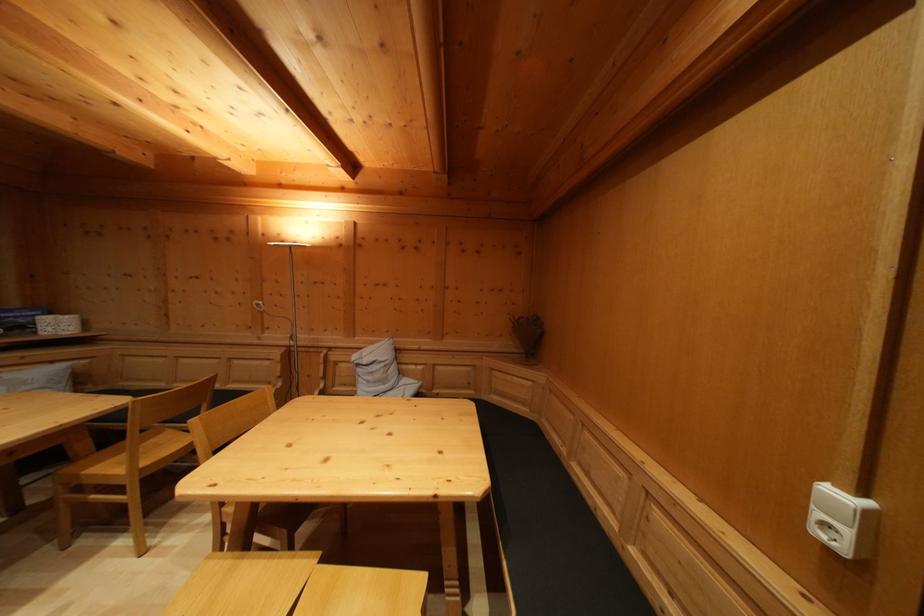
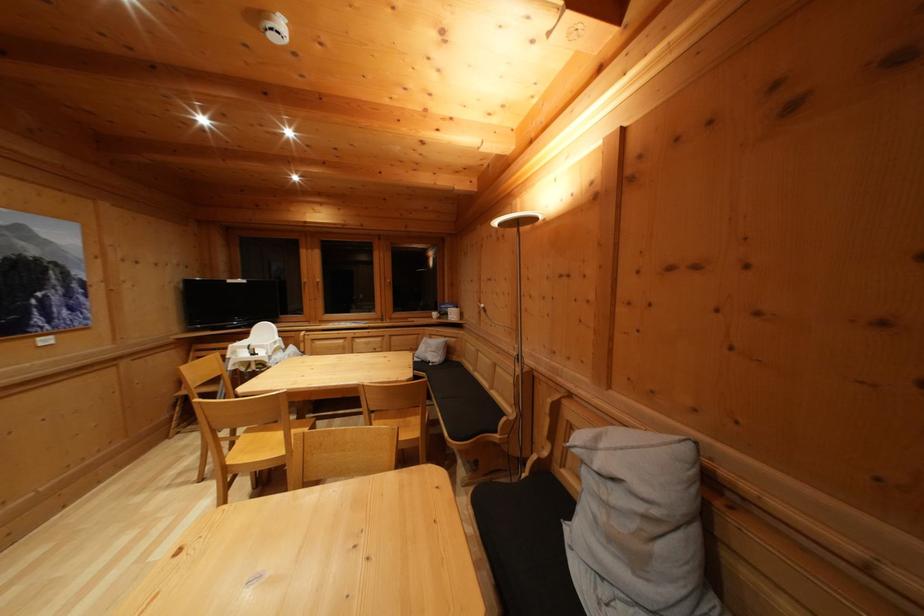
In the second image, find the point that corresponds to the point at 390,387 in the first image.

(640, 565)